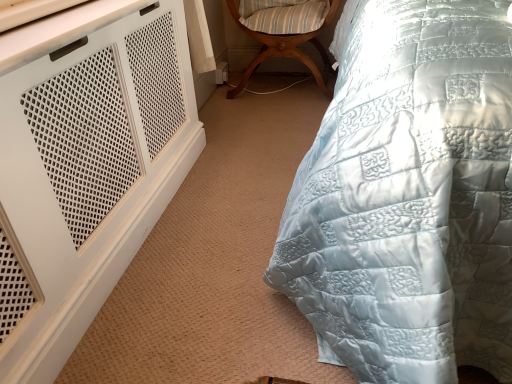
Question: Is light blue quilted fabric at center inside wooden striped cushioned chair at center?

Choices:
 (A) yes
 (B) no

Answer: (B)

Question: From a real-world perspective, is wooden striped cushioned chair at center over light blue quilted fabric at center?

Choices:
 (A) yes
 (B) no

Answer: (B)

Question: Is wooden striped cushioned chair at center facing away from light blue quilted fabric at center?

Choices:
 (A) yes
 (B) no

Answer: (B)

Question: Does wooden striped cushioned chair at center lie behind light blue quilted fabric at center?

Choices:
 (A) yes
 (B) no

Answer: (A)

Question: Considering the relative positions of wooden striped cushioned chair at center and light blue quilted fabric at center in the image provided, is wooden striped cushioned chair at center to the left of light blue quilted fabric at center from the viewer's perspective?

Choices:
 (A) yes
 (B) no

Answer: (A)

Question: Considering the relative sizes of wooden striped cushioned chair at center and light blue quilted fabric at center in the image provided, is wooden striped cushioned chair at center smaller than light blue quilted fabric at center?

Choices:
 (A) yes
 (B) no

Answer: (A)

Question: From the image's perspective, does light blue quilted fabric at center appear higher than wooden striped cushioned chair at center?

Choices:
 (A) yes
 (B) no

Answer: (B)

Question: Can you confirm if light blue quilted fabric at center is positioned to the right of wooden striped cushioned chair at center?

Choices:
 (A) no
 (B) yes

Answer: (B)

Question: Does light blue quilted fabric at center come behind wooden striped cushioned chair at center?

Choices:
 (A) no
 (B) yes

Answer: (A)

Question: From a real-world perspective, is light blue quilted fabric at center located higher than wooden striped cushioned chair at center?

Choices:
 (A) no
 (B) yes

Answer: (B)

Question: Is light blue quilted fabric at center turned away from wooden striped cushioned chair at center?

Choices:
 (A) no
 (B) yes

Answer: (A)

Question: Can you confirm if light blue quilted fabric at center is thinner than wooden striped cushioned chair at center?

Choices:
 (A) yes
 (B) no

Answer: (B)

Question: From the image's perspective, is light blue quilted fabric at center above or below wooden striped cushioned chair at center?

Choices:
 (A) below
 (B) above

Answer: (A)